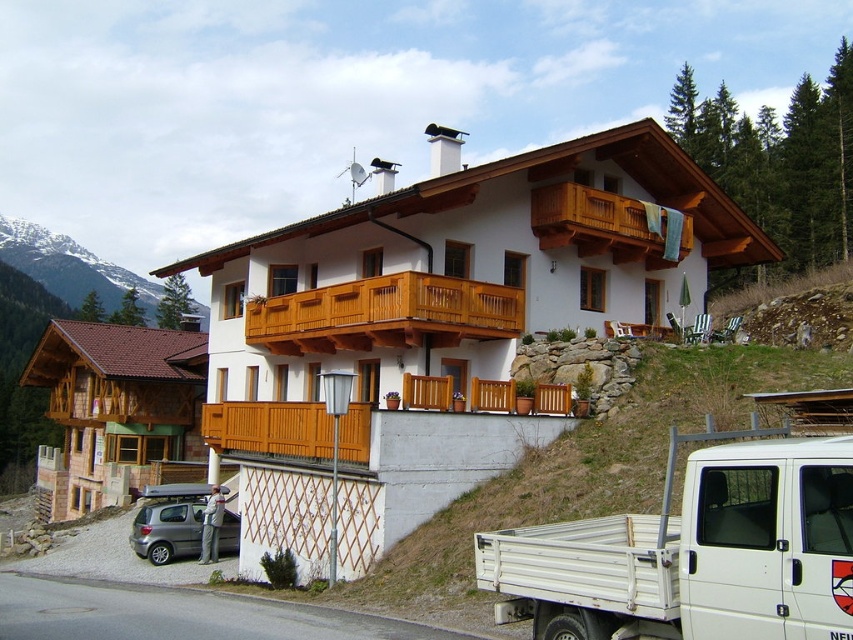
You are a visitor arriving at the alpine house and need to park your car. You see the white wooden chalet at center and the metallic gray hatchback at lower left. Which object is taller, and would that affect where you park?

The white wooden chalet at center is much taller than the metallic gray hatchback at lower left. Since the chalet is taller, it might cast a shadow over the parking area, so parking near the metallic gray hatchback at lower left could be better for sunlight access.

You are standing in front of the white wooden chalet at center and want to reach the wooden balcony at upper center. Which direction should you move relative to the chalet?

You should move to the right relative to the white wooden chalet at center because the wooden balcony at upper center is located to the right of the chalet.

You are a delivery driver who needs to park your vehicle in a spot that requires a vehicle height of 1.8 meters. You have a white metallic truck at lower right and a metallic gray hatchback at lower left. Which vehicle can park there?

The white metallic truck at lower right has a lesser height compared to metallic gray hatchback at lower left. Since the parking spot requires a vehicle height of 1.8 meters, the white metallic truck at lower right is shorter and can park there, while the metallic gray hatchback at lower left may be too tall.